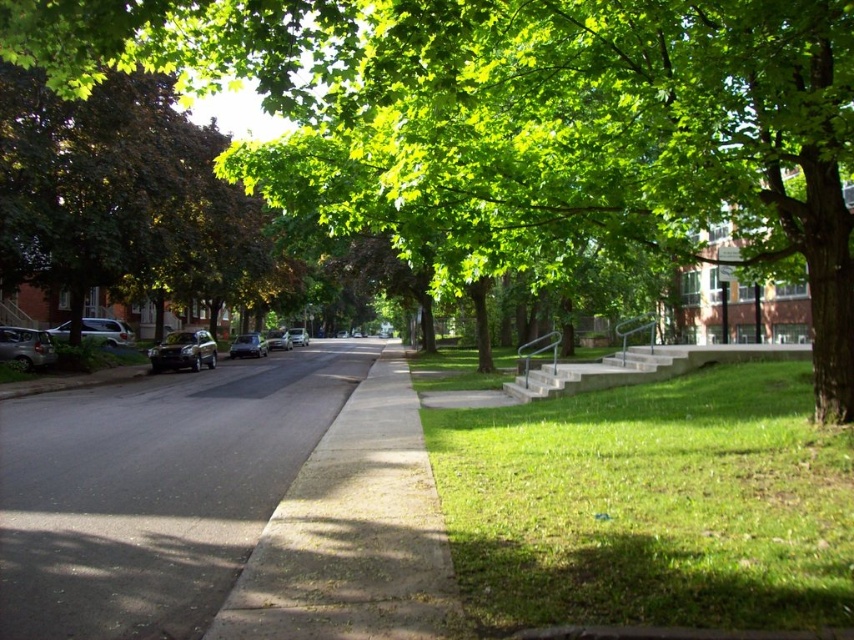
From the picture: Is gray concrete sidewalk at center bigger than green leafy tree at left?

No.

Which is more to the right, gray concrete sidewalk at center or green leafy tree at left?

gray concrete sidewalk at center is more to the right.

Which is behind, point (300, 349) or point (273, 288)?

The point (300, 349) is more distant.

Find the location of a particular element. The image size is (854, 640). gray concrete sidewalk at center is located at coordinates (154, 490).

Describe the element at coordinates (183, 352) in the screenshot. The width and height of the screenshot is (854, 640). I see `shiny black sedan at left` at that location.

Who is more distant from viewer, (200, 342) or (303, 337)?

The point (303, 337) is behind.

The image size is (854, 640). What do you see at coordinates (183, 352) in the screenshot?
I see `shiny black sedan at left` at bounding box center [183, 352].

Find the location of a particular element. The width and height of the screenshot is (854, 640). shiny black sedan at left is located at coordinates (183, 352).

Who is higher up, shiny black sedan at left or shiny silver sedan at center-left?

Positioned higher is shiny black sedan at left.

Describe the element at coordinates (183, 352) in the screenshot. I see `shiny black sedan at left` at that location.

The width and height of the screenshot is (854, 640). Find the location of `shiny black sedan at left`. shiny black sedan at left is located at coordinates (183, 352).